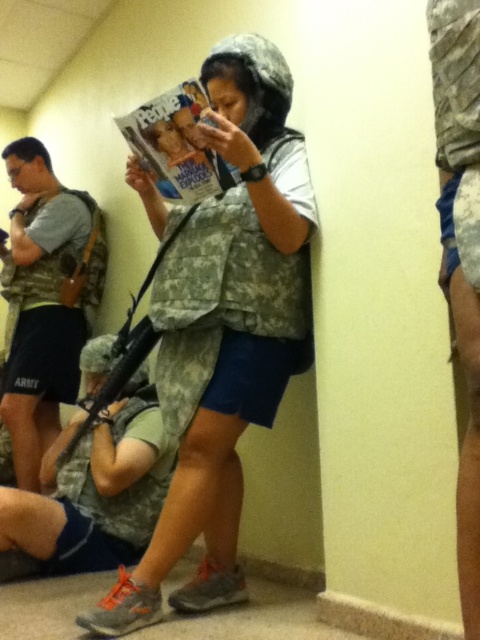
Where is the camouflage vest at center located in the image?

The camouflage vest at center is located at point coordinates (225, 330).

You are a security guard at an airport. You see a camouflage fabric backpack at left and a camouflage fabric rifle at center. According to airport security policies, which item is prohibited and must be confiscated?

The camouflage fabric rifle at center is prohibited and must be confiscated because it is a firearm, while the camouflage fabric backpack at left is just a bag.

Looking at this image, you are a security guard in the room. You need to check the height of the camouflage vest at center and the camouflage fabric backpack at left. Which one is taller?

The camouflage vest at center is much taller than the camouflage fabric backpack at left.